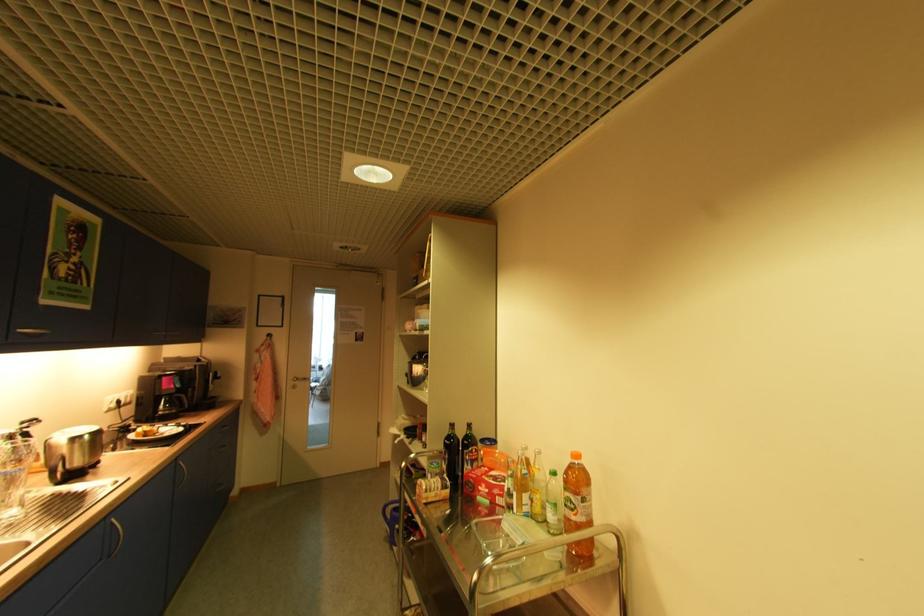
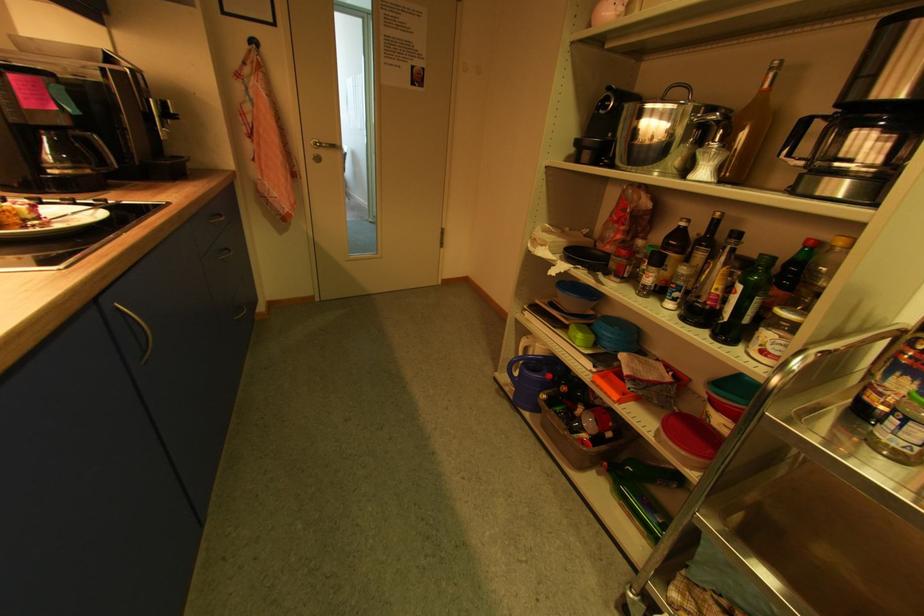
Find the pixel in the second image that matches point 185,399 in the first image.

(94, 145)